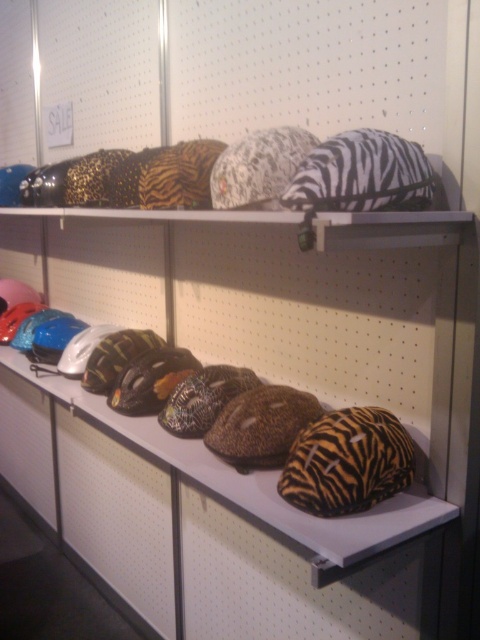
Question: Is zebra-patterned helmet at center above zebra print pillow at upper right?

Choices:
 (A) no
 (B) yes

Answer: (A)

Question: Can you confirm if zebra-patterned helmet at center is wider than zebra print pillow at upper right?

Choices:
 (A) yes
 (B) no

Answer: (A)

Question: Can you confirm if zebra-patterned helmet at center is wider than zebra print pillow at upper right?

Choices:
 (A) no
 (B) yes

Answer: (B)

Question: Which point is closer to the camera taking this photo?

Choices:
 (A) (412, 234)
 (B) (404, 205)

Answer: (A)

Question: Which point is closer to the camera?

Choices:
 (A) zebra print pillow at upper right
 (B) zebra-patterned helmet at center

Answer: (B)

Question: Which of the following is the farthest from the observer?

Choices:
 (A) zebra-patterned helmet at center
 (B) zebra print pillow at upper right

Answer: (B)